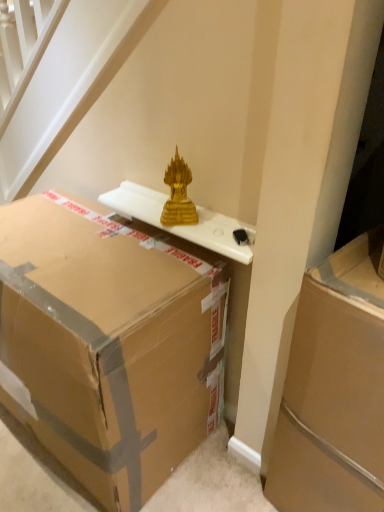
Question: Is gold glass sculpture at upper center thinner than brown cardboard box at center, which appears as the second box when viewed from the right?

Choices:
 (A) yes
 (B) no

Answer: (A)

Question: Is gold glass sculpture at upper center completely or partially outside of brown cardboard box at center, which appears as the second box when viewed from the right?

Choices:
 (A) yes
 (B) no

Answer: (A)

Question: From the image's perspective, is gold glass sculpture at upper center beneath brown cardboard box at center, which appears as the second box when viewed from the right?

Choices:
 (A) no
 (B) yes

Answer: (A)

Question: Is gold glass sculpture at upper center to the left of brown cardboard box at center, positioned as the 1th box in left-to-right order, from the viewer's perspective?

Choices:
 (A) yes
 (B) no

Answer: (B)

Question: From a real-world perspective, is gold glass sculpture at upper center under brown cardboard box at center, positioned as the 1th box in left-to-right order?

Choices:
 (A) no
 (B) yes

Answer: (A)

Question: Can you confirm if gold glass sculpture at upper center is taller than brown cardboard box at center, which appears as the second box when viewed from the right?

Choices:
 (A) no
 (B) yes

Answer: (A)

Question: Would you say brown cardboard box at center, positioned as the 1th box in left-to-right order, is part of brown cardboard box at right, which is the second box from left to right,'s contents?

Choices:
 (A) no
 (B) yes

Answer: (A)

Question: From a real-world perspective, is brown cardboard box at right, arranged as the 1th box when viewed from the right, on brown cardboard box at center, positioned as the 1th box in left-to-right order?

Choices:
 (A) no
 (B) yes

Answer: (B)

Question: Can you confirm if brown cardboard box at right, which is the second box from left to right, is smaller than brown cardboard box at center, which appears as the second box when viewed from the right?

Choices:
 (A) no
 (B) yes

Answer: (B)

Question: Is brown cardboard box at right, which is the second box from left to right, in contact with brown cardboard box at center, positioned as the 1th box in left-to-right order?

Choices:
 (A) no
 (B) yes

Answer: (A)

Question: Is brown cardboard box at right, which is the second box from left to right, further to camera compared to brown cardboard box at center, which appears as the second box when viewed from the right?

Choices:
 (A) yes
 (B) no

Answer: (B)

Question: Can you confirm if brown cardboard box at right, which is the second box from left to right, is wider than brown cardboard box at center, which appears as the second box when viewed from the right?

Choices:
 (A) yes
 (B) no

Answer: (B)

Question: Considering the relative sizes of white glossy table at upper center and gold glass sculpture at upper center in the image provided, is white glossy table at upper center thinner than gold glass sculpture at upper center?

Choices:
 (A) yes
 (B) no

Answer: (B)